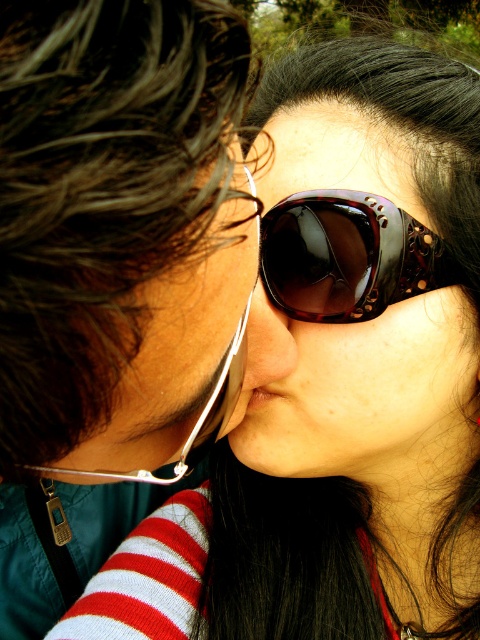
Question: Which point is farther to the camera?

Choices:
 (A) shiny tortoiseshell sunglasses at center
 (B) matte black nose at center
 (C) sunglasses at center

Answer: (A)

Question: Does sunglasses at center appear on the left side of sunglasses at left?

Choices:
 (A) no
 (B) yes

Answer: (A)

Question: Estimate the real-world distances between objects in this image. Which object is farther from the matte black nose at center?

Choices:
 (A) sunglasses at left
 (B) sunglasses at center

Answer: (A)

Question: Can you confirm if sunglasses at left is positioned below matte black nose at center?

Choices:
 (A) yes
 (B) no

Answer: (A)

Question: Can you confirm if sunglasses at left is positioned to the left of shiny tortoiseshell sunglasses at center?

Choices:
 (A) yes
 (B) no

Answer: (A)

Question: Which point appears farthest from the camera in this image?

Choices:
 (A) (279, 310)
 (B) (345, 250)

Answer: (A)